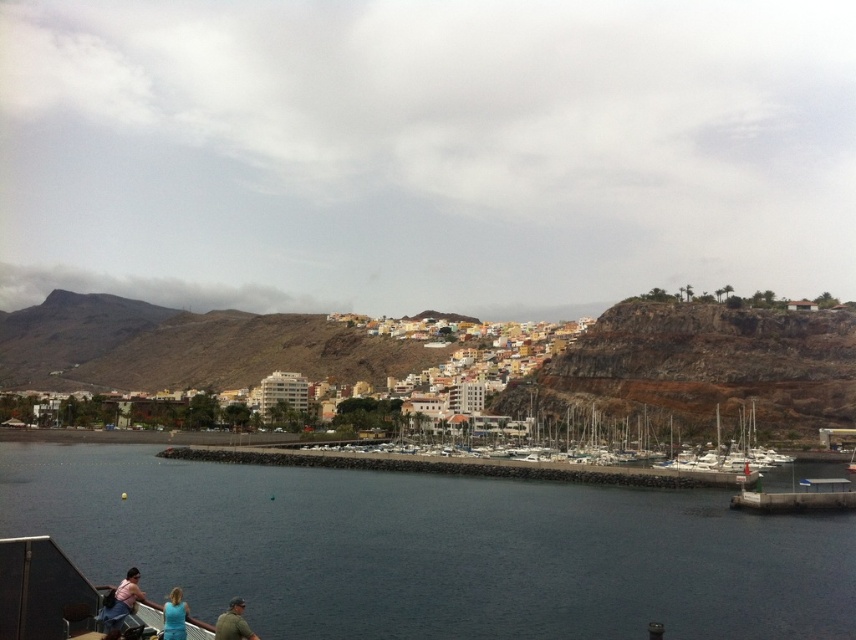
You are standing at the entrance of the coastal town and see the matte pink shirt at lower left. If you walk straight ahead, will the shirt remain in your line of sight?

The matte pink shirt at lower left is located at point (120, 602), which is near the lower left corner of the scene. Walking straight ahead might take you away from that area, so the shirt may no longer be in your line of sight.

You are a photographer standing in the coastal town and see the matte pink shirt at lower left and the green fabric shirt at lower center. Which shirt is positioned higher in the image?

The matte pink shirt at lower left is positioned higher than the green fabric shirt at lower center.

You are standing at the edge of the marina in the coastal town and see two points marked in the image. Which point is closer to you, point (660, 369) or point (165, 602)?

Point (660, 369) is further to the viewer than point (165, 602), so the closer point to you is point (165, 602).